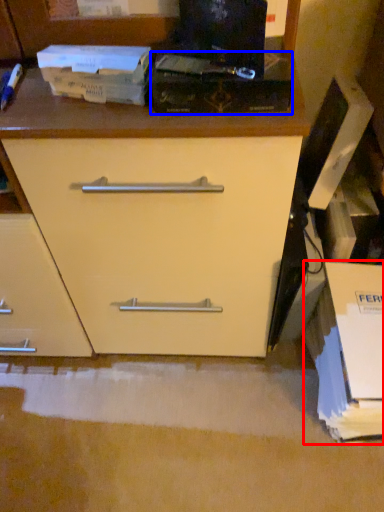
Question: Which of the following is the farthest to the observer, cardboard box (highlighted by a red box) or paperback book (highlighted by a blue box)?

Choices:
 (A) cardboard box
 (B) paperback book

Answer: (A)